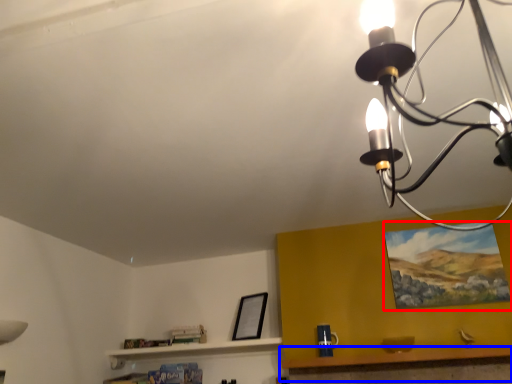
Question: Which object is closer to the camera taking this photo, picture frame (highlighted by a red box) or table (highlighted by a blue box)?

Choices:
 (A) picture frame
 (B) table

Answer: (B)